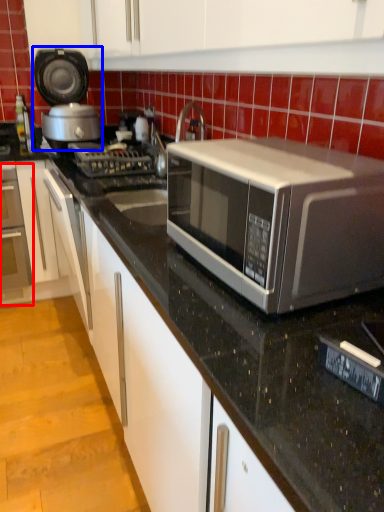
Question: Which object appears farthest to the camera in this image, oven (highlighted by a red box) or appliance (highlighted by a blue box)?

Choices:
 (A) oven
 (B) appliance

Answer: (A)